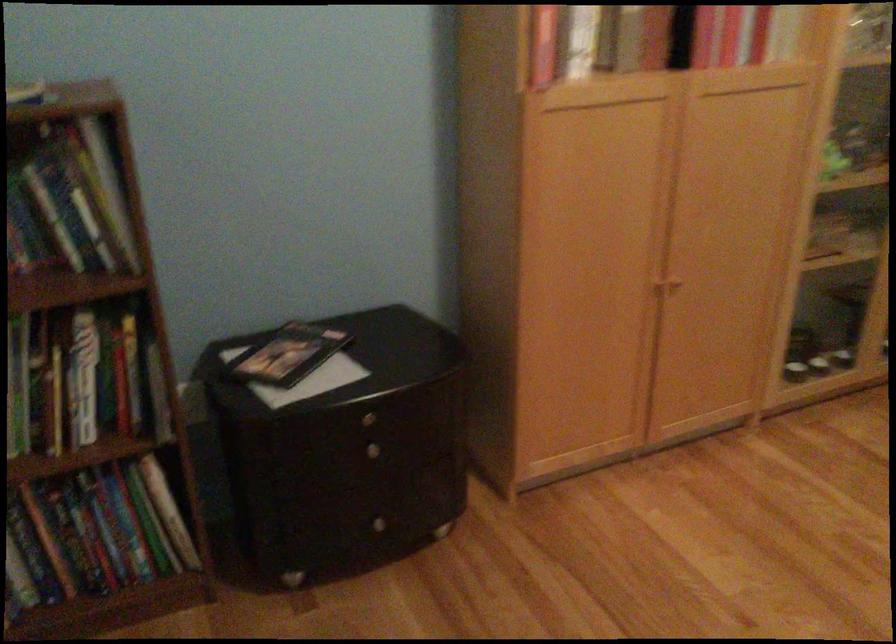
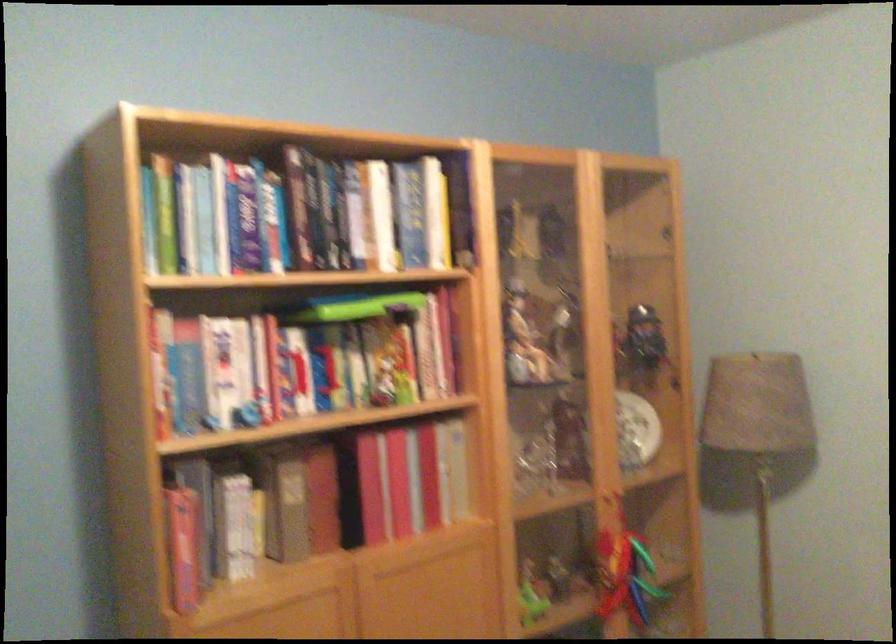
Question: What movement of the cameraman would produce the second image?

Choices:
 (A) Left
 (B) Right
 (C) Forward
 (D) Backward

Answer: (B)